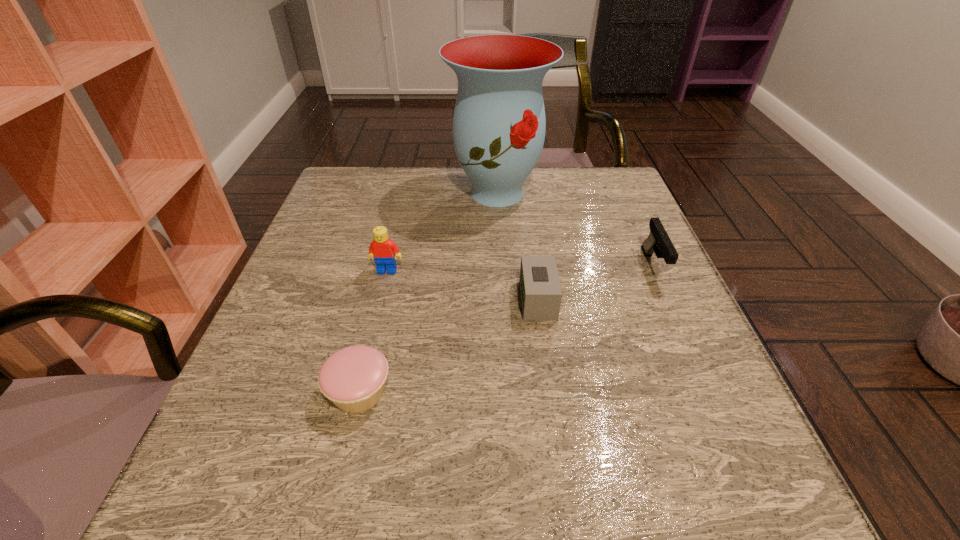
This screenshot has height=540, width=960. I want to click on free location that satisfies the following two spatial constraints: 1. on the front-facing side of the third tallest object; 2. on the front-facing side of the alarm clock, so click(667, 300).

Where is `free spot that satisfies the following two spatial constraints: 1. on the face of the nearest object; 2. on the right side of the second tallest object`? The width and height of the screenshot is (960, 540). free spot that satisfies the following two spatial constraints: 1. on the face of the nearest object; 2. on the right side of the second tallest object is located at coordinates (358, 392).

Locate an element on the screen. The height and width of the screenshot is (540, 960). free space that satisfies the following two spatial constraints: 1. on the face of the cupcake; 2. on the right side of the Lego is located at coordinates (358, 392).

Identify the location of vacant space that satisfies the following two spatial constraints: 1. on the face of the Lego; 2. on the left side of the cupcake. pyautogui.click(x=358, y=392).